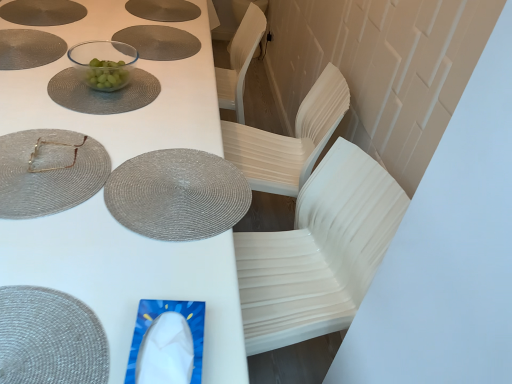
Identify the location of vacant space that is in between matte silver placemat at upper left, the 1th platter in the left-to-right sequence, and transparent glass bowl at upper center, the first glass plate in the back-to-front sequence. (59, 43).